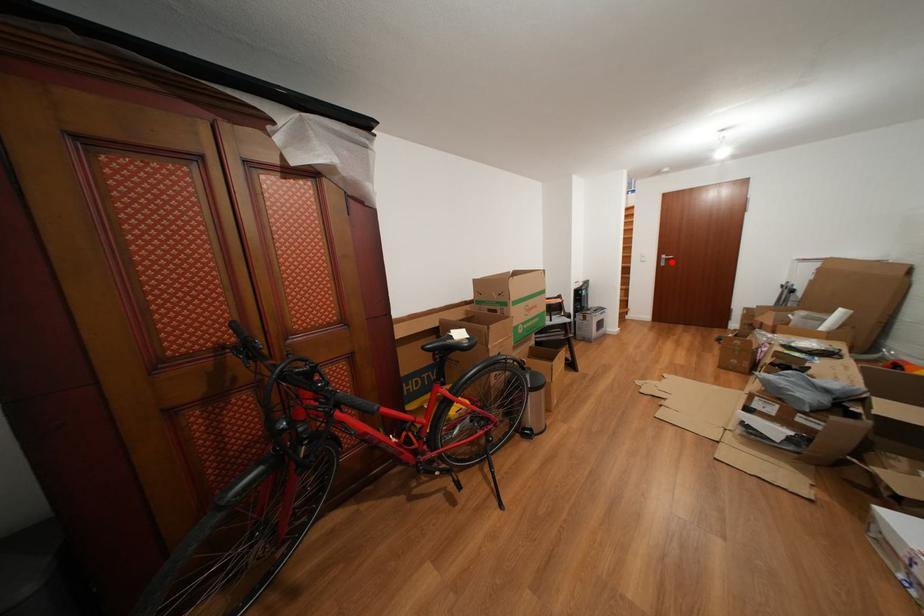
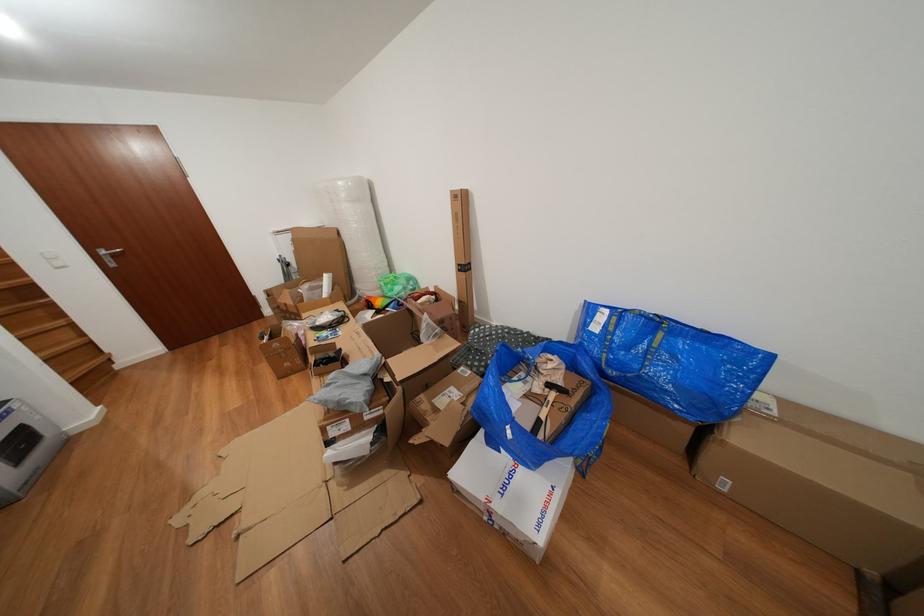
Question: I am providing you with two images of the same scene from different viewpoints. Image1 has a red point marked. In image2, the corresponding 3D location appears at what relative position? Reply with the corresponding letter.

Choices:
 (A) Closer
 (B) Farther

Answer: (B)